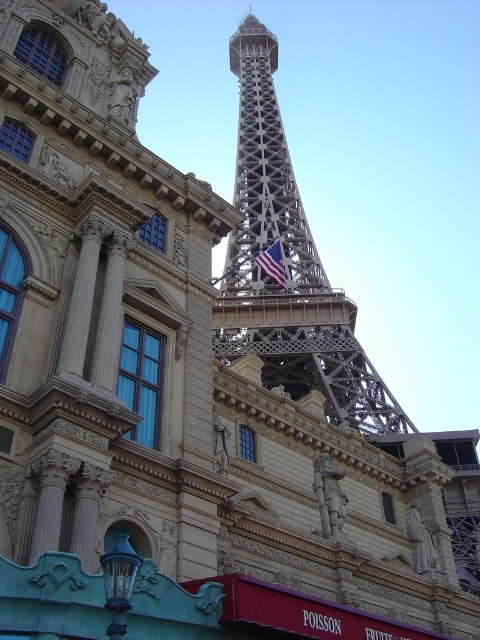
You are a tourist standing in front of the classical European building in the foreground. You want to take a photo of the american flag at center while ensuring the metallic structure at center is also visible in the frame. Based on their positions, which direction should you move to include both in your photo?

Since the metallic structure at center is to the left of the american flag at center, you should move to the right to ensure both the metallic structure at center and the american flag at center are visible in your photo.

You are standing at the point with coordinates (288, 266) in the image. What type of structure are you facing?

The structure at point (288, 266) is a metallic structure at center.